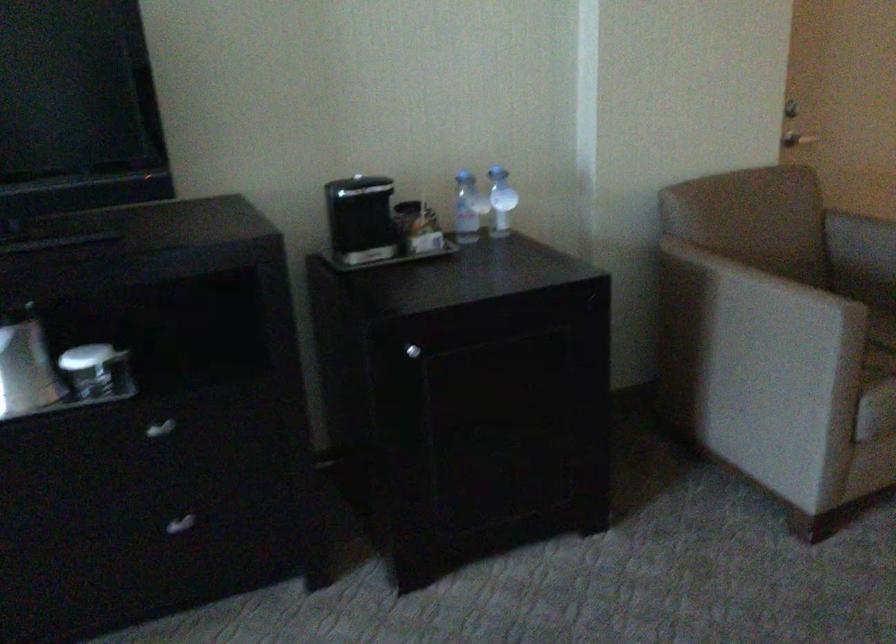
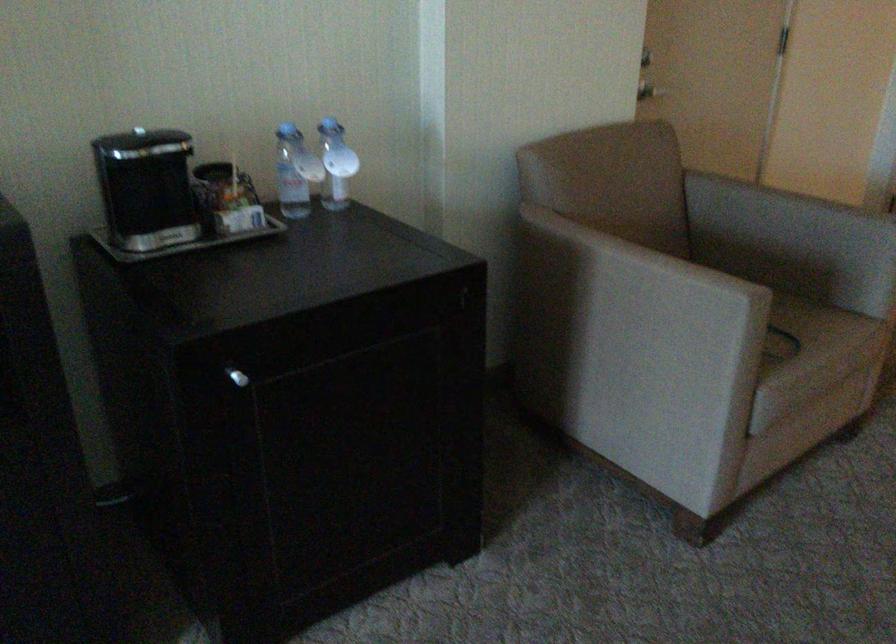
The point at (410, 351) is marked in the first image. Where is the corresponding point in the second image?

(237, 377)